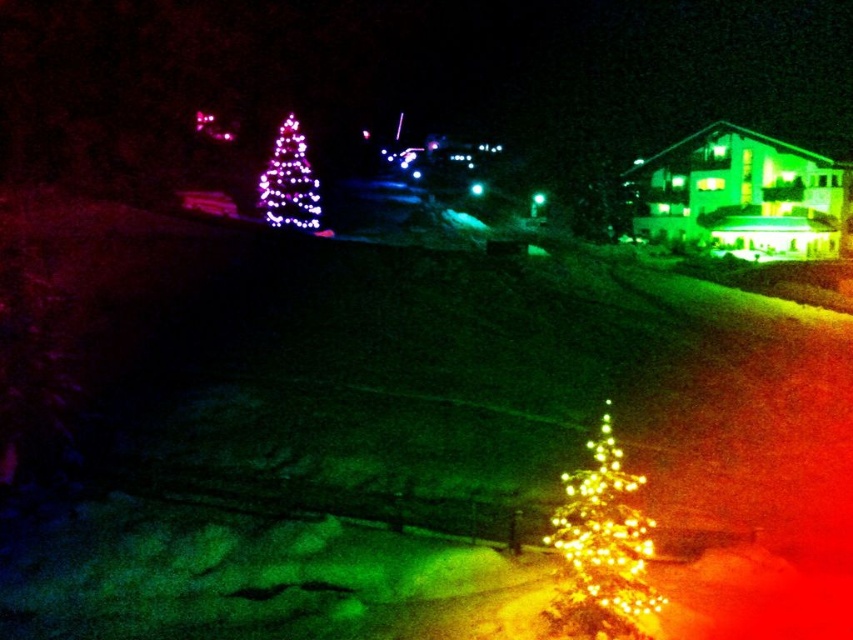
Is illuminated plastic christmas tree at lower right above illuminated plastic christmas tree at upper left?

No.

Measure the distance between point (572, 486) and camera.

Point (572, 486) and camera are 29.37 feet apart.

Identify the location of illuminated plastic christmas tree at lower right. (602, 548).

Where is `illuminated plastic christmas tree at lower right`? illuminated plastic christmas tree at lower right is located at coordinates (602, 548).